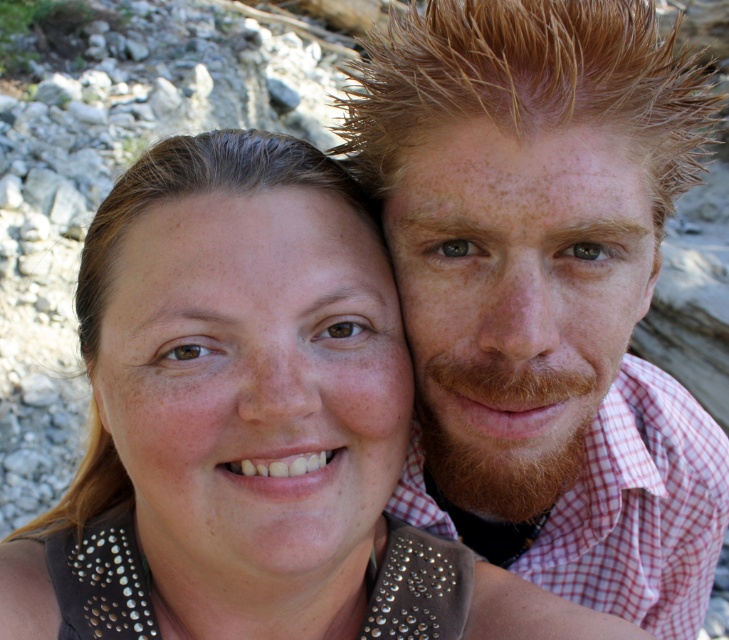
You are standing in front of a rocky landscape with two people posing. You need to reach a specific point marked at coordinates point (566, 540). Considering you are 5 feet tall, can you step onto this point without needing to climb any rocks?

The point (566, 540) is 6.31 feet away from viewer. Since you are 5 feet tall, you can step onto this point without needing to climb any rocks as the distance is within a reachable range.